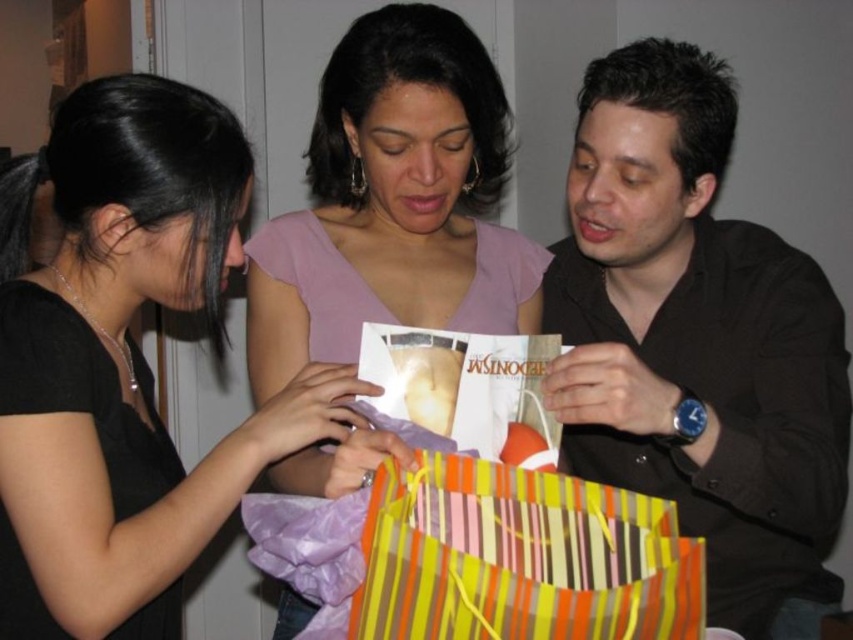
Question: Is pink fabric shirt at center bigger than striped paper gift bag at lower center?

Choices:
 (A) no
 (B) yes

Answer: (B)

Question: Is matte purple blouse at center positioned at the back of pink fabric shirt at center?

Choices:
 (A) no
 (B) yes

Answer: (A)

Question: Considering the relative positions of black matte shirt at right and matte purple blouse at center in the image provided, where is black matte shirt at right located with respect to matte purple blouse at center?

Choices:
 (A) right
 (B) left

Answer: (A)

Question: Estimate the real-world distances between objects in this image. Which object is closer to the matte purple blouse at center?

Choices:
 (A) black matte shirt at right
 (B) striped paper gift bag at lower center

Answer: (B)

Question: Among these points, which one is nearest to the camera?

Choices:
 (A) [335, 236]
 (B) [692, 632]
 (C) [648, 124]
 (D) [0, 401]

Answer: (B)

Question: Which is farther from the pink fabric shirt at center?

Choices:
 (A) matte purple blouse at center
 (B) black matte shirt at right
 (C) striped paper gift bag at lower center

Answer: (C)